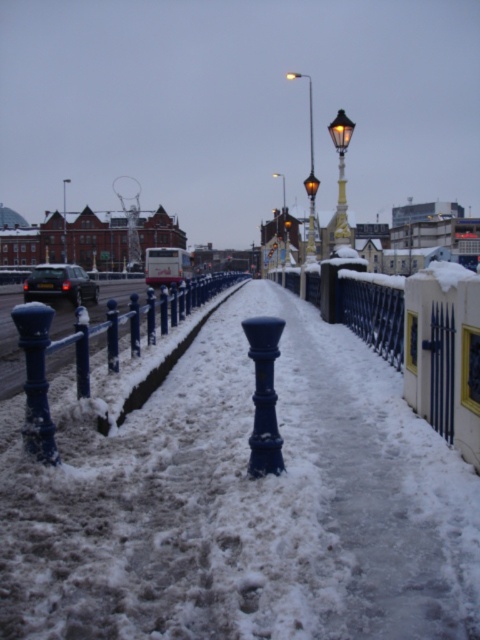
Is white snow at center to the right of blue glossy post at center from the viewer's perspective?

Indeed, white snow at center is positioned on the right side of blue glossy post at center.

Is white snow at center positioned at the back of blue glossy post at center?

No.

The width and height of the screenshot is (480, 640). What do you see at coordinates (245, 504) in the screenshot?
I see `white snow at center` at bounding box center [245, 504].

At what (x,y) coordinates should I click in order to perform the action: click on white snow at center. Please return your answer as a coordinate pair (x, y). Looking at the image, I should click on (245, 504).

Between blue painted metal rail at center and matte black lamp post at center, which one has less height?

blue painted metal rail at center

Is point (98, 328) positioned behind point (63, 227)?

No, it is in front of (63, 227).

This screenshot has width=480, height=640. I want to click on blue painted metal rail at center, so click(x=88, y=349).

Based on the photo, can you confirm if glossy blue post at center is smaller than matte black lamp post at upper center?

Yes, glossy blue post at center is smaller than matte black lamp post at upper center.

Between glossy blue post at center and matte black lamp post at upper center, which one has less height?

With less height is glossy blue post at center.

Is point (251, 467) closer to viewer compared to point (304, 186)?

Yes, it is in front of point (304, 186).

This screenshot has width=480, height=640. Identify the location of glossy blue post at center. (264, 394).